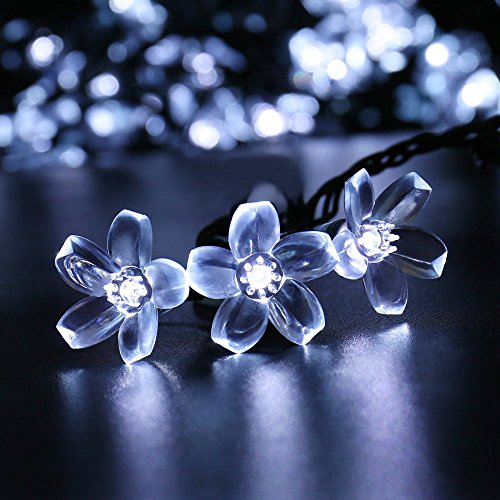
In order to click on tabletop in this screenshot , I will do `click(59, 438)`, `click(458, 457)`, `click(464, 284)`, `click(39, 184)`, `click(308, 164)`.